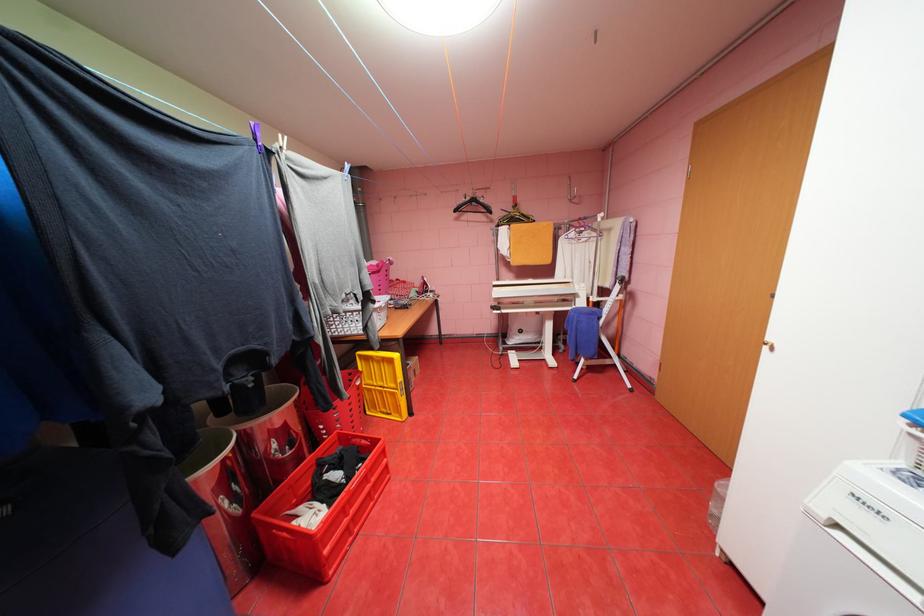
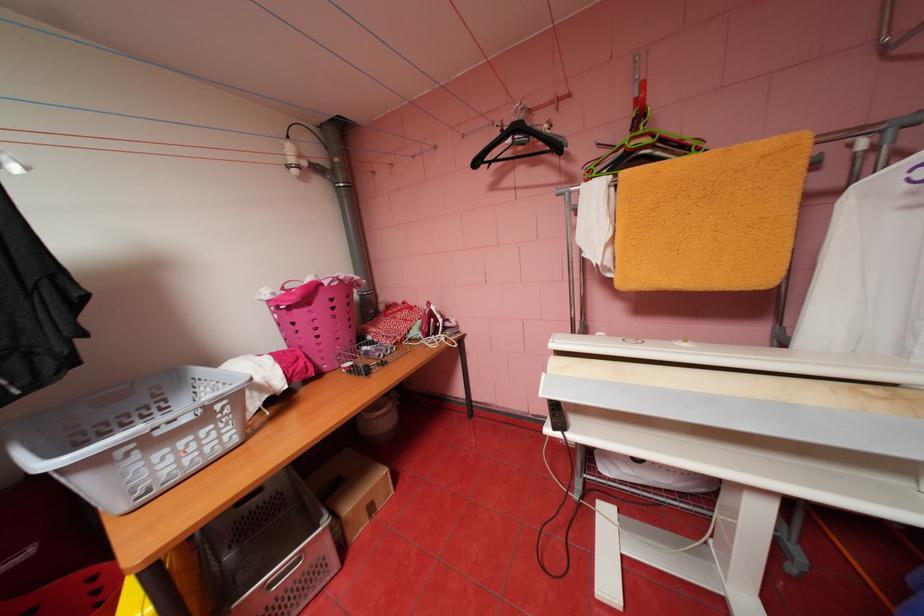
The point at (464, 209) is marked in the first image. Where is the corresponding point in the second image?

(484, 163)